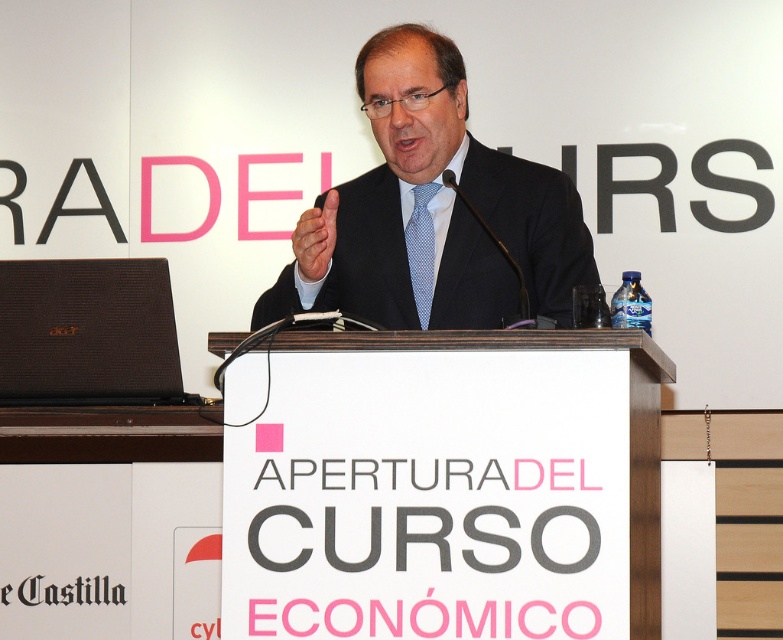
From the picture: You are a photographer at the event and need to capture a clear photo of both the dark blue suit at center and the brown textured laptop at left. Since the camera can only focus on one object at a time, which object should you focus on to ensure the other remains in the background?

You should focus on the dark blue suit at center because it is closer to the viewer, and the brown textured laptop at left will naturally be in the background.

You are an event photographer trying to capture the speaker and the screen. You notice two points of interest marked as point coordinates in the image. Which point is closer to the camera? The points are point 1 at coordinates point (x=417, y=26) and point 2 at coordinates point (x=41, y=292). Please answer based on their positions in the scene.

Point 1 at coordinates point (x=417, y=26) is closer to the camera than point 2 at coordinates point (x=41, y=292) because it is further to the viewer in the scene.

You are an event planner who needs to ensure all items are visible to the audience. The dark blue suit at center and the brown textured laptop at left are both on the stage. Which item is more likely to block the view of the audience?

The dark blue suit at center is much taller than the brown textured laptop at left, so it is more likely to block the audience view.